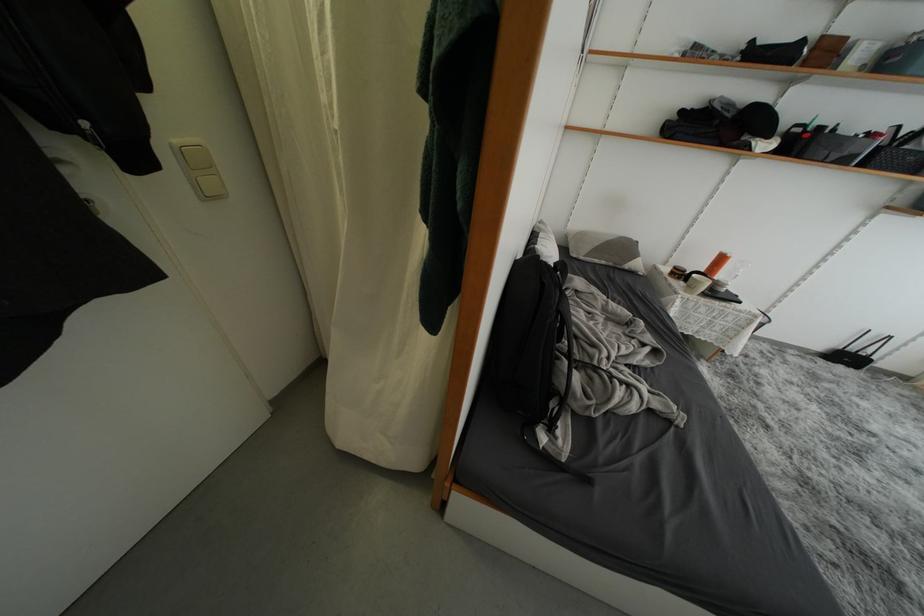
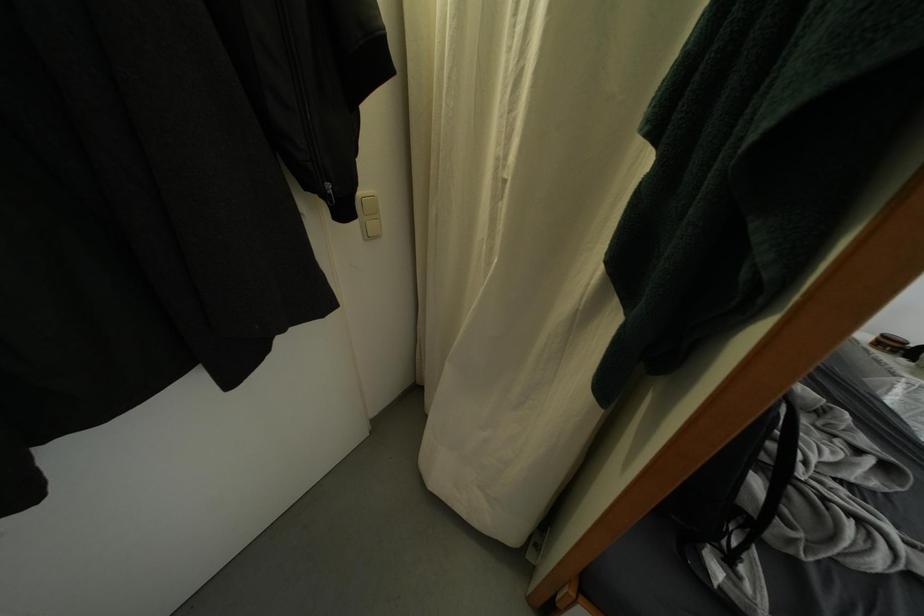
The point at [677,278] is marked in the first image. Where is the corresponding point in the second image?

(884, 347)